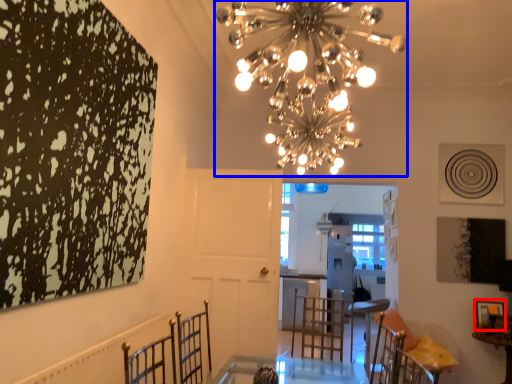
Question: Which of the following is the farthest to the observer, picture frame (highlighted by a red box) or chandelier (highlighted by a blue box)?

Choices:
 (A) picture frame
 (B) chandelier

Answer: (A)